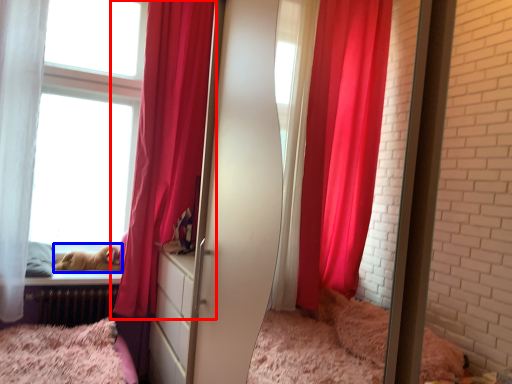
Question: Which object appears closest to the camera in this image, curtain (highlighted by a red box) or animal (highlighted by a blue box)?

Choices:
 (A) curtain
 (B) animal

Answer: (A)